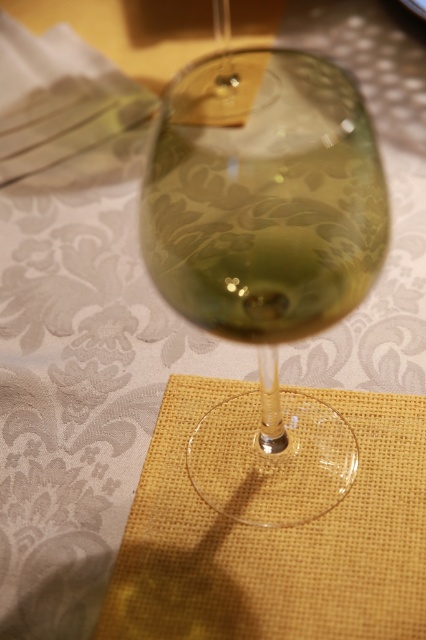
Between transparent glass at center and burlap placemat at center, which one has less height?

burlap placemat at center is shorter.

Between point (288, 67) and point (291, 563), which one is positioned in front?

Point (288, 67) is in front.

I want to click on transparent glass at center, so click(265, 259).